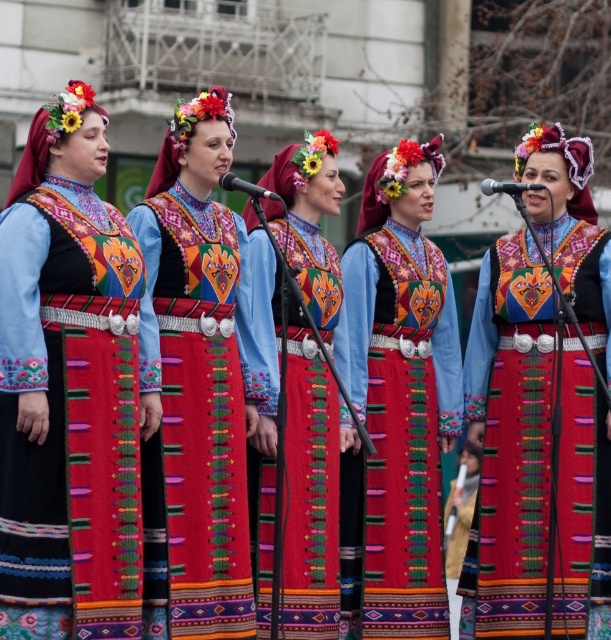
Question: From the image, what is the correct spatial relationship of matte blue dress at center in relation to matte floral dress at center?

Choices:
 (A) below
 (B) above

Answer: (A)

Question: Which object is farther from the camera taking this photo?

Choices:
 (A) matte floral dress at center
 (B) embroidered fabric dress at center
 (C) matte blue dress at center
 (D) matte fabric dress at center

Answer: (D)

Question: Can you confirm if embroidered fabric dress at center is thinner than matte fabric dress at center?

Choices:
 (A) no
 (B) yes

Answer: (B)

Question: Which point is closer to the camera?

Choices:
 (A) [331, 168]
 (B) [397, 358]
 (C) [560, 209]
 (D) [45, 220]

Answer: (D)

Question: Can you confirm if matte blue dress at center is positioned to the left of embroidered fabric dress at center?

Choices:
 (A) no
 (B) yes

Answer: (A)

Question: Which object appears farthest from the camera in this image?

Choices:
 (A) matte floral dress at center
 (B) embroidered fabric dress at center

Answer: (A)